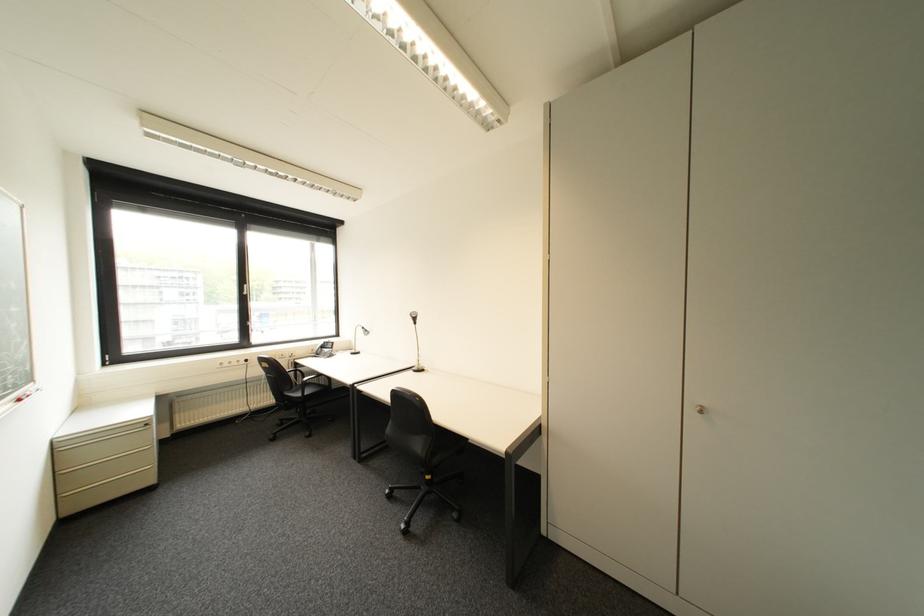
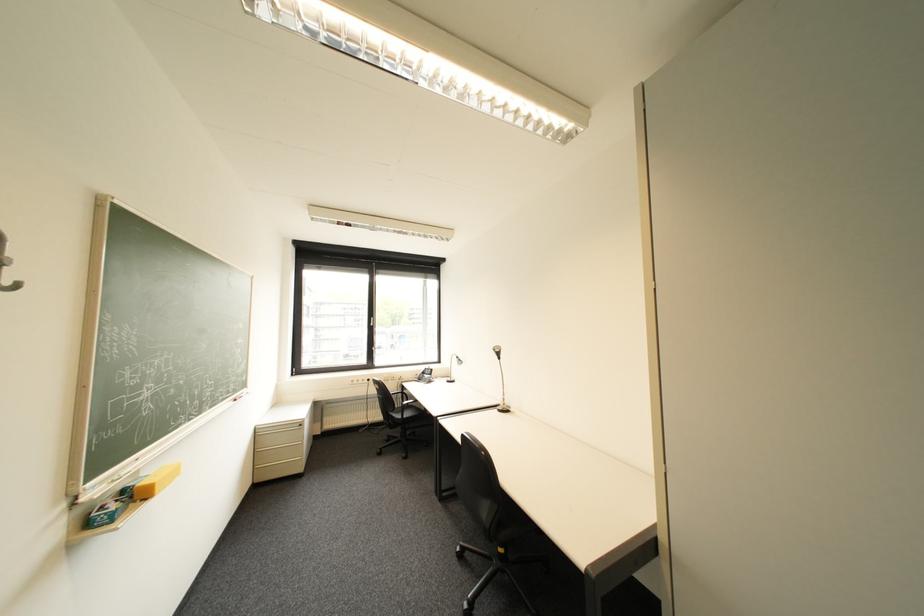
Question: The first image is from the beginning of the video and the second image is from the end. How did the camera likely rotate when shooting the video?

Choices:
 (A) Left
 (B) Right
 (C) Up
 (D) Down

Answer: (A)